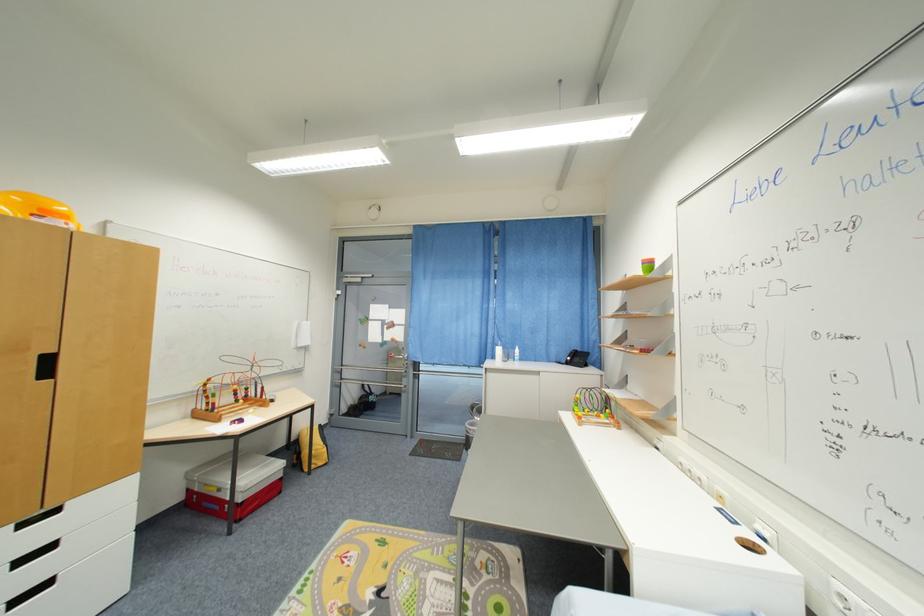
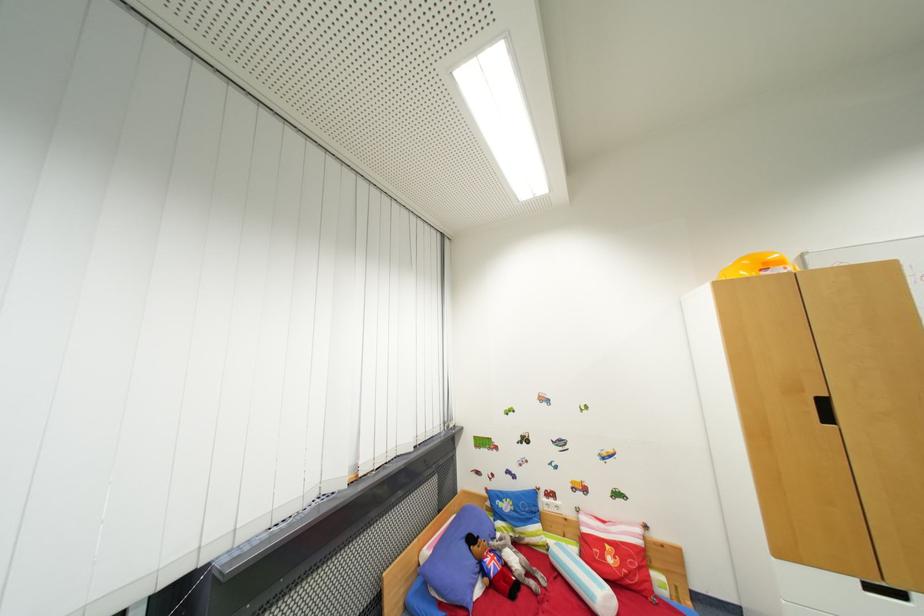
The point at (68, 217) is marked in the first image. Where is the corresponding point in the second image?

(785, 265)